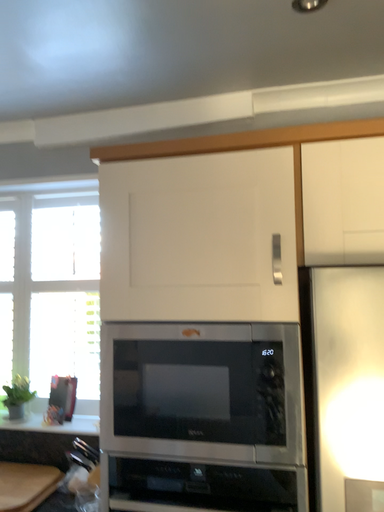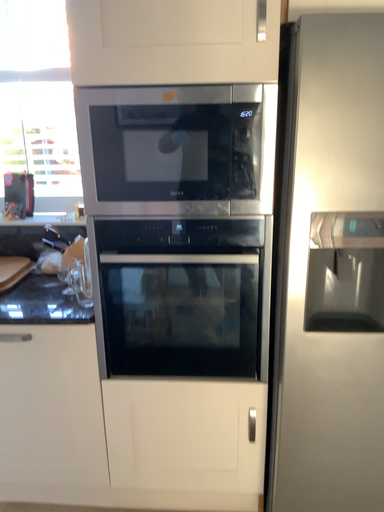
Question: How did the camera likely rotate when shooting the video?

Choices:
 (A) rotated upward
 (B) rotated downward

Answer: (B)